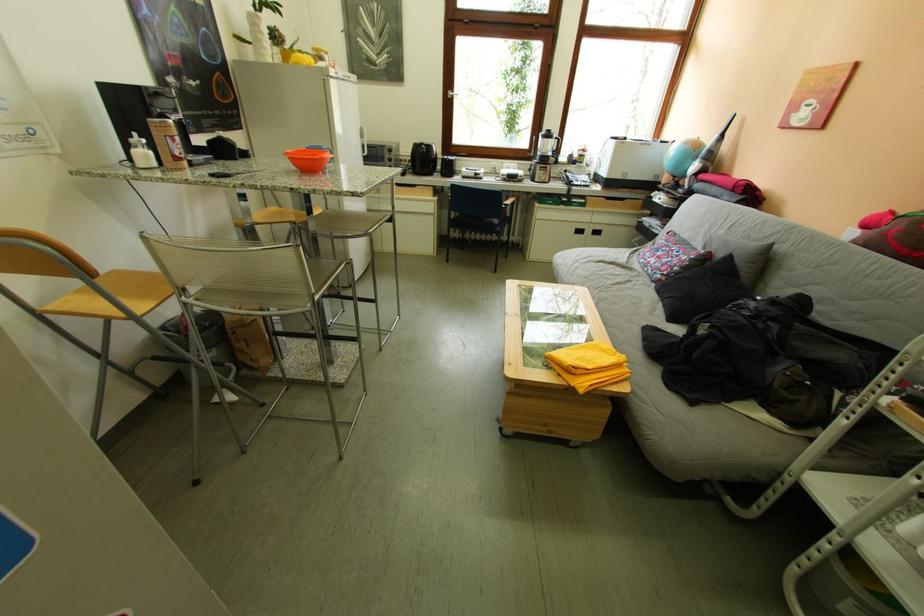
Find where to sit the sofa sitting surface. Please return your answer as a coordinate pair (x, y).

(774, 416)